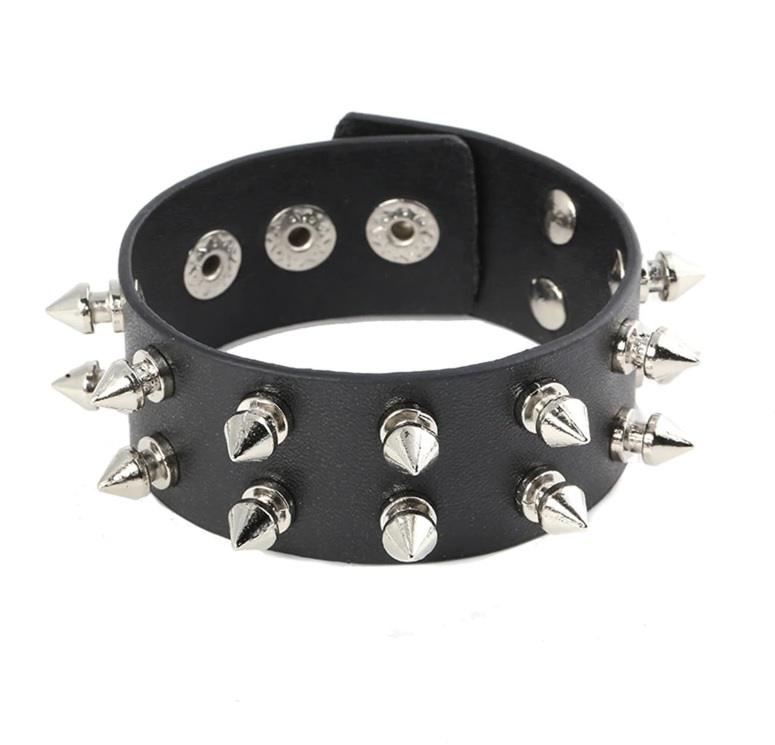
Where is `white surface the object is resting on`? Image resolution: width=775 pixels, height=745 pixels. white surface the object is resting on is located at coordinates (407, 340).